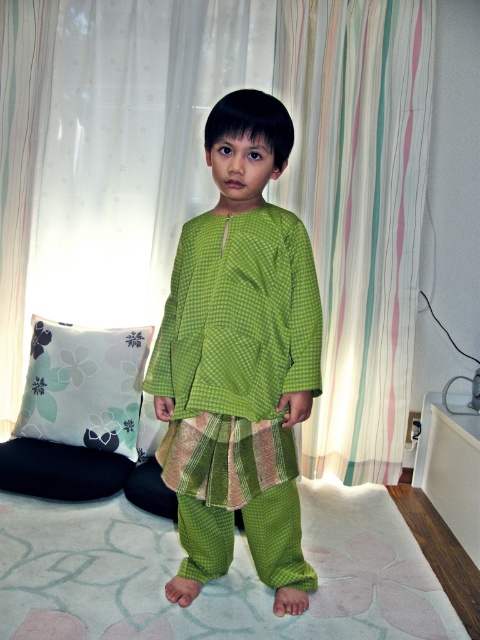
You are a photographer standing in front of the green checkered outfit at center. You want to take a closeup shot of the outfit without moving the child. Considering your current position, can you get a clear closeup shot of the outfit?

The green checkered outfit at center is 5.09 feet from viewer, so yes, you can get a clear closeup shot of the outfit from your current position as it is within a reasonable distance for photography.